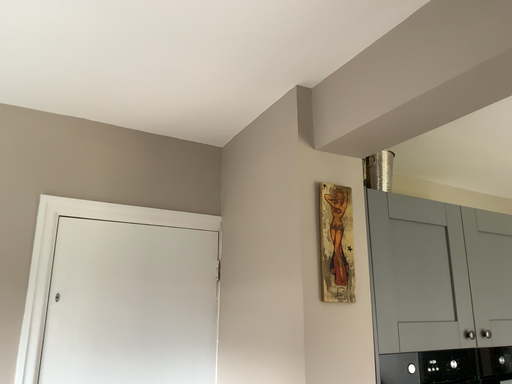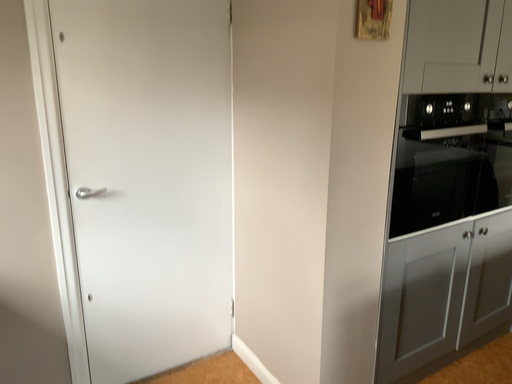
Question: How did the camera likely rotate when shooting the video?

Choices:
 (A) rotated downward
 (B) rotated upward

Answer: (A)